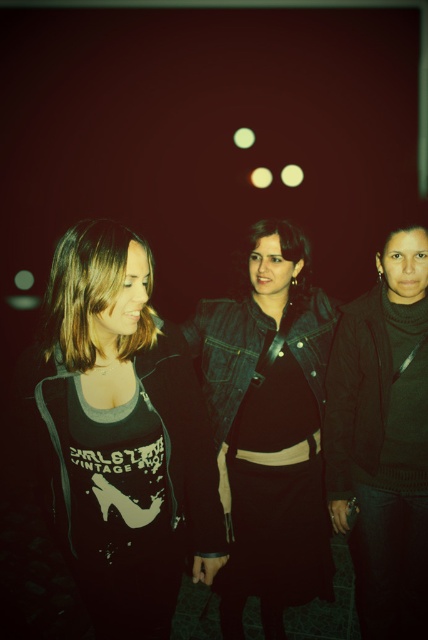
Does denim jacket at center come behind black matte jacket at right?

Yes.

Is denim jacket at center positioned before black matte jacket at right?

No, it is not.

Is point (309, 580) closer to camera compared to point (345, 308)?

No, (309, 580) is further to viewer.

Where is `denim jacket at center`? This screenshot has height=640, width=428. denim jacket at center is located at coordinates (270, 428).

Is black matte t-shirt at left positioned at the back of black matte jacket at right?

No, it is in front of black matte jacket at right.

Is point (110, 452) positioned behind point (403, 488)?

No.

Locate an element on the screen. black matte t-shirt at left is located at coordinates (124, 436).

In the scene shown: Does black matte t-shirt at left have a greater width compared to denim jacket at center?

In fact, black matte t-shirt at left might be narrower than denim jacket at center.

Which is below, black matte t-shirt at left or denim jacket at center?

Positioned lower is denim jacket at center.

Is point (174, 419) less distant than point (297, 458)?

That is True.

Where is `black matte t-shirt at left`? The image size is (428, 640). black matte t-shirt at left is located at coordinates (124, 436).